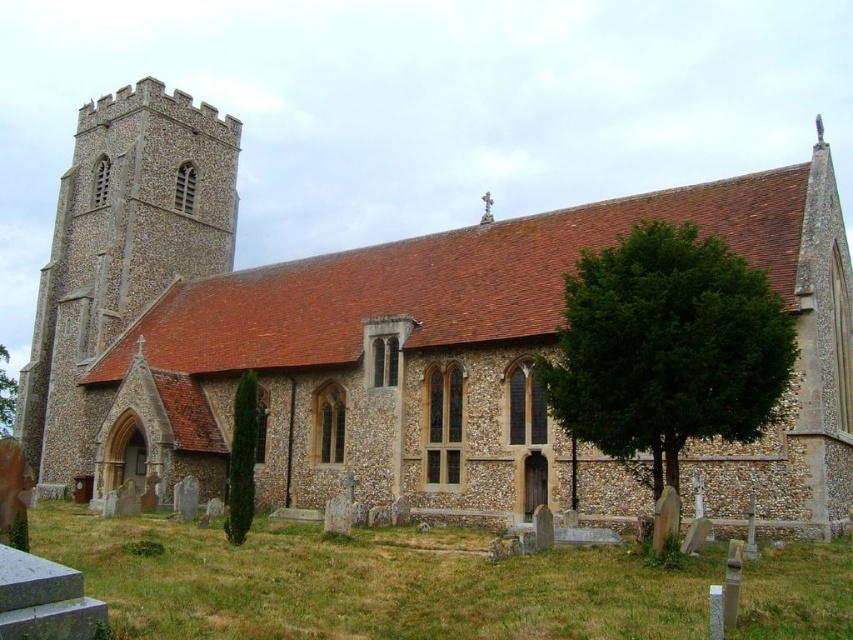
Is point (779, 524) positioned before point (3, 384)?

That is True.

Is point (55, 241) farther from camera compared to point (0, 356)?

No, it is not.

Find the location of a particular element. This screenshot has height=640, width=853. brown stone church at center is located at coordinates (386, 336).

Is green leafy tree at lower right positioned behind green textured tree at lower left?

No, green leafy tree at lower right is closer to the viewer.

Does green leafy tree at lower right have a greater height compared to green textured tree at lower left?

Yes.

Who is more distant from viewer, (686,420) or (250,508)?

The point (250,508) is more distant.

What are the coordinates of `green leafy tree at lower right` in the screenshot? It's located at (666, 348).

Is green textured tree at lower left to the right of green leafy tree at left from the viewer's perspective?

Yes, green textured tree at lower left is to the right of green leafy tree at left.

Is green textured tree at lower left below green leafy tree at left?

Actually, green textured tree at lower left is above green leafy tree at left.

I want to click on green textured tree at lower left, so click(241, 460).